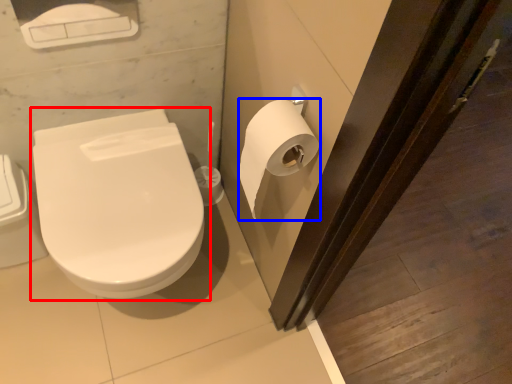
Question: Which object is closer to the camera taking this photo, toilet (highlighted by a red box) or toilet paper (highlighted by a blue box)?

Choices:
 (A) toilet
 (B) toilet paper

Answer: (B)